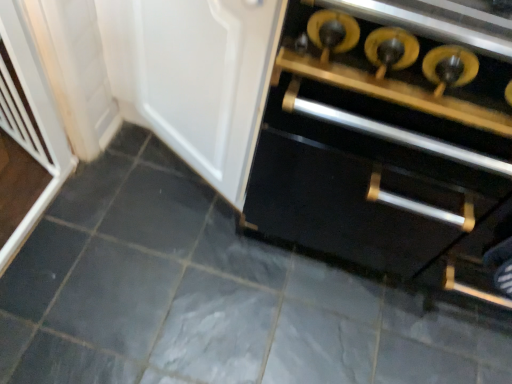
Locate an element on the screen. This screenshot has height=384, width=512. gray matte tile at center is located at coordinates (209, 296).

This screenshot has height=384, width=512. What do you see at coordinates (195, 77) in the screenshot?
I see `matte white door at center` at bounding box center [195, 77].

Locate an element on the screen. This screenshot has height=384, width=512. matte white door at center is located at coordinates (195, 77).

I want to click on white plastic screen door at left, so click(29, 117).

What's the angular difference between gray matte tile at center and white plastic screen door at left's facing directions?

22.3 degrees.

Looking at this image, between gray matte tile at center and white plastic screen door at left, which one is positioned in front?

white plastic screen door at left is more forward.

Considering the sizes of gray matte tile at center and white plastic screen door at left in the image, is gray matte tile at center bigger or smaller than white plastic screen door at left?

Clearly, gray matte tile at center is larger in size than white plastic screen door at left.

From the picture: Which is more to the left, gray matte tile at center or white plastic screen door at left?

white plastic screen door at left is more to the left.

Can you confirm if black matte cabinet at center is smaller than matte white door at center?

No, black matte cabinet at center is not smaller than matte white door at center.

Is black matte cabinet at center turned away from matte white door at center?

No.

From the image's perspective, is black matte cabinet at center beneath matte white door at center?

Correct, black matte cabinet at center appears lower than matte white door at center in the image.

Considering the relative sizes of gray matte tile at center and black matte cabinet at center in the image provided, is gray matte tile at center shorter than black matte cabinet at center?

Yes.

Between point (116, 350) and point (470, 80), which one is positioned behind?

The point (116, 350) is more distant.

I want to click on cabinetry located above the gray matte tile at center (from a real-world perspective), so click(382, 149).

Is gray matte tile at center spatially inside black matte cabinet at center, or outside of it?

gray matte tile at center is spatially situated outside black matte cabinet at center.

In terms of height, does black matte cabinet at center look taller or shorter compared to white plastic screen door at left?

black matte cabinet at center is taller than white plastic screen door at left.

Is point (350, 139) less distant than point (61, 124)?

Yes, point (350, 139) is closer to viewer.

From the image's perspective, which one is positioned lower, black matte cabinet at center or white plastic screen door at left?

black matte cabinet at center, from the image's perspective.

Considering the relative sizes of white plastic screen door at left and matte white door at center in the image provided, is white plastic screen door at left smaller than matte white door at center?

Yes.

Is white plastic screen door at left positioned beyond the bounds of matte white door at center?

white plastic screen door at left is positioned outside matte white door at center.

Is the position of white plastic screen door at left less distant than that of matte white door at center?

No, it is behind matte white door at center.

From the image's perspective, does white plastic screen door at left appear higher than matte white door at center?

No, from the image's perspective, white plastic screen door at left is not on top of matte white door at center.

Is white plastic screen door at left positioned with its back to black matte cabinet at center?

No, black matte cabinet at center is not at the back of white plastic screen door at left.

Is white plastic screen door at left outside of black matte cabinet at center?

Yes, white plastic screen door at left is located beyond the bounds of black matte cabinet at center.

From a real-world perspective, does white plastic screen door at left sit lower than black matte cabinet at center?

Yes, from a real-world perspective, white plastic screen door at left is under black matte cabinet at center.

Is point (13, 95) closer or farther from the camera than point (314, 250)?

Clearly, point (13, 95) is closer to the camera than point (314, 250).

Do you think white plastic screen door at left is within gray matte tile at center, or outside of it?

white plastic screen door at left is not inside gray matte tile at center, it's outside.

From the image's perspective, is white plastic screen door at left on gray matte tile at center?

Yes.

From a real-world perspective, which is physically above, white plastic screen door at left or gray matte tile at center?

white plastic screen door at left.

Is white plastic screen door at left directly adjacent to gray matte tile at center?

No, white plastic screen door at left is not beside gray matte tile at center.

Where is `screen door that is above the gray matte tile at center (from the image's perspective)`? This screenshot has height=384, width=512. screen door that is above the gray matte tile at center (from the image's perspective) is located at coordinates (29, 117).

You are a GUI agent. You are given a task and a screenshot of the screen. Output one action in this format:
    pyautogui.click(x=<x>, y=<y>)
    Task: Click on the door behind the black matte cabinet at center
    Image resolution: width=512 pixels, height=384 pixels.
    Given the screenshot: What is the action you would take?
    pyautogui.click(x=195, y=77)

When comparing their distances from gray matte tile at center, does matte white door at center or white plastic screen door at left seem closer?

Based on the image, matte white door at center appears to be nearer to gray matte tile at center.

Which object lies nearer to the anchor point white plastic screen door at left, matte white door at center or black matte cabinet at center?

Among the two, matte white door at center is located nearer to white plastic screen door at left.

Considering their positions, is gray matte tile at center positioned closer to white plastic screen door at left than matte white door at center?

matte white door at center lies closer to white plastic screen door at left than the other object.

From the image, which object appears to be nearer to black matte cabinet at center, matte white door at center or gray matte tile at center?

matte white door at center lies closer to black matte cabinet at center than the other object.

From the image, which object appears to be nearer to black matte cabinet at center, white plastic screen door at left or matte white door at center?

matte white door at center is closer to black matte cabinet at center.

Looking at the image, which one is located closer to matte white door at center, gray matte tile at center or black matte cabinet at center?

Based on the image, black matte cabinet at center appears to be nearer to matte white door at center.

From the image, which object appears to be farther from black matte cabinet at center, gray matte tile at center or matte white door at center?

gray matte tile at center lies further to black matte cabinet at center than the other object.

Which object lies nearer to the anchor point gray matte tile at center, matte white door at center or black matte cabinet at center?

Among the two, black matte cabinet at center is located nearer to gray matte tile at center.

Identify the location of cabinetry that lies between matte white door at center and gray matte tile at center from top to bottom. The image size is (512, 384). (382, 149).

At what (x,y) coordinates should I click in order to perform the action: click on door between white plastic screen door at left and gray matte tile at center from left to right. Please return your answer as a coordinate pair (x, y). Image resolution: width=512 pixels, height=384 pixels. Looking at the image, I should click on (195, 77).

At what (x,y) coordinates should I click in order to perform the action: click on ceramic tile between white plastic screen door at left and black matte cabinet at center from left to right. Please return your answer as a coordinate pair (x, y). This screenshot has width=512, height=384. Looking at the image, I should click on (209, 296).

Identify the location of door located between white plastic screen door at left and black matte cabinet at center in the left-right direction. (195, 77).